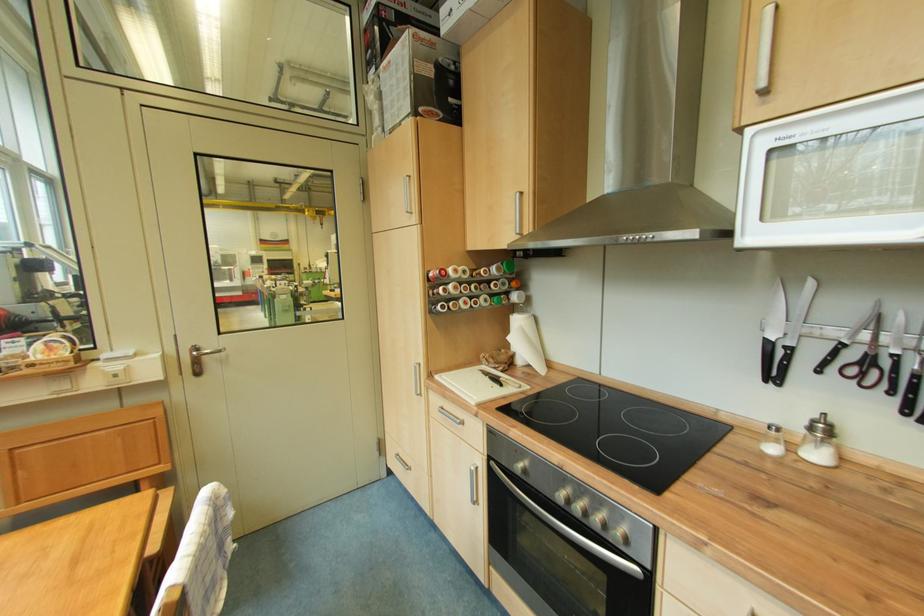
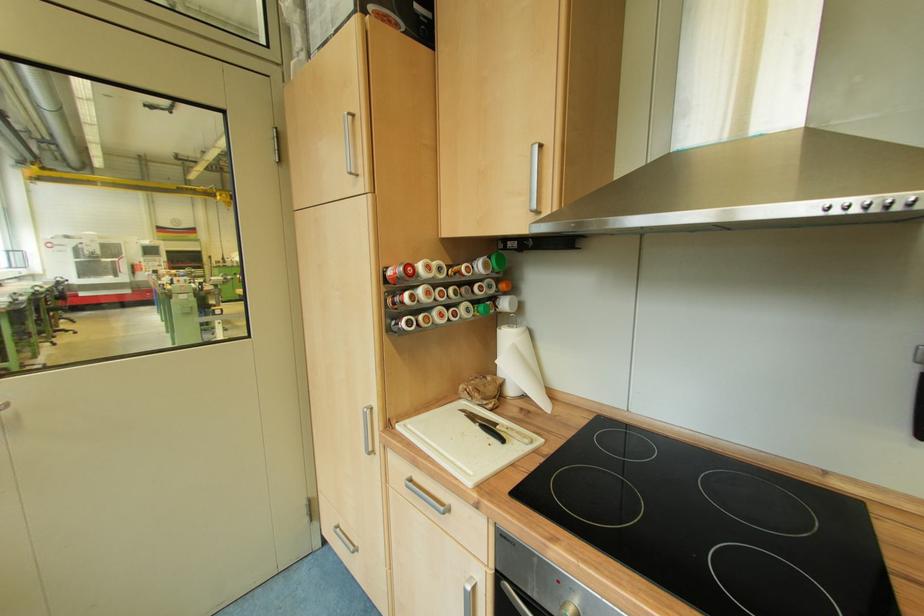
Question: The images are taken continuously from a first-person perspective. In which direction is your viewpoint rotating?

Choices:
 (A) Left
 (B) Right
 (C) Up
 (D) Down

Answer: (B)